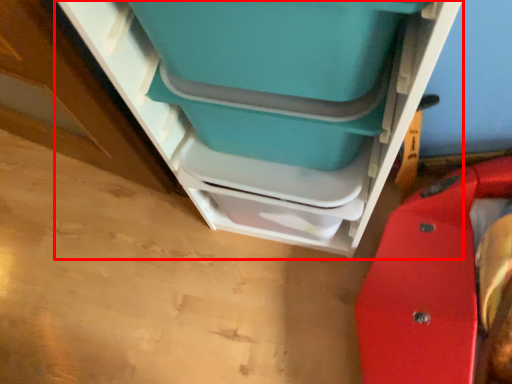
Question: From the image's perspective, where is furniture (annotated by the red box) located in relation to turquoise in the image?

Choices:
 (A) above
 (B) below

Answer: (B)